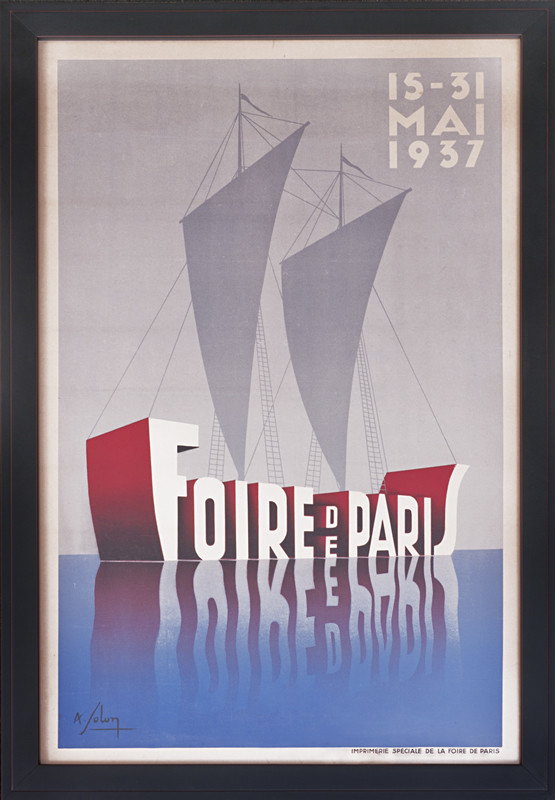
Where is `black photo frame`? The width and height of the screenshot is (555, 800). black photo frame is located at coordinates (245, 14).